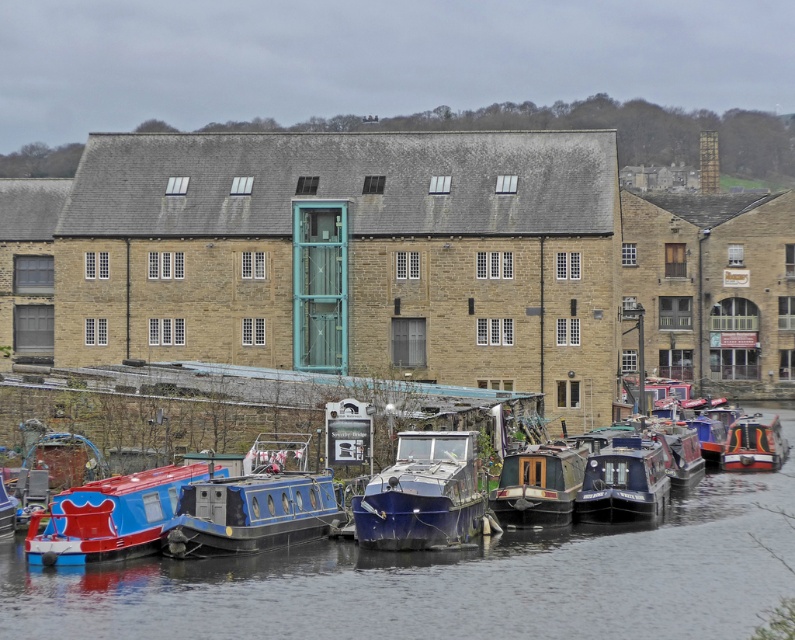
Question: Is blue glossy boats at lower center bigger than blue polished wood boat at center?

Choices:
 (A) no
 (B) yes

Answer: (B)

Question: Which of the following is the closest to the observer?

Choices:
 (A) (277, 488)
 (B) (689, 484)
 (C) (26, 540)
 (D) (435, 468)

Answer: (C)

Question: Is blue glossy boats at lower center further to camera compared to orange glossy boat at center?

Choices:
 (A) yes
 (B) no

Answer: (B)

Question: Which object is farther from the camera taking this photo?

Choices:
 (A) orange glossy boat at center
 (B) metallic blue boat at center
 (C) blue glossy boats at lower center
 (D) shiny blue boat at lower left

Answer: (A)

Question: Considering the relative positions of blue matte boat at center and blue glossy boat at lower left in the image provided, where is blue matte boat at center located with respect to blue glossy boat at lower left?

Choices:
 (A) below
 (B) above

Answer: (B)

Question: Which of these objects is positioned closest to the blue glossy canal boat at center?

Choices:
 (A) shiny blue boat at lower left
 (B) blue glossy boat at lower left
 (C) blue polished wood boat at center

Answer: (C)